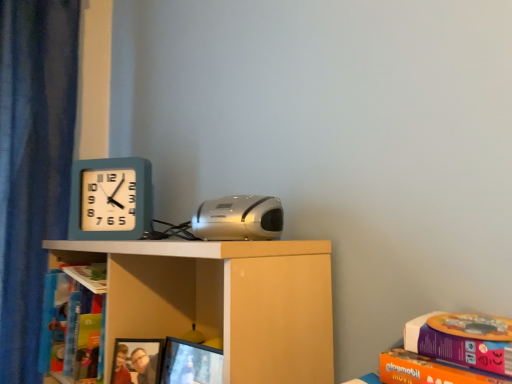
Question: Is blue cardboard book at left, arranged as the second book when viewed from the right, at the left side of silver metallic stereo at center?

Choices:
 (A) yes
 (B) no

Answer: (A)

Question: Can you confirm if blue cardboard book at left, acting as the 2th book starting from the front, is bigger than silver metallic stereo at center?

Choices:
 (A) yes
 (B) no

Answer: (B)

Question: Is silver metallic stereo at center inside blue cardboard book at left, acting as the 2th book starting from the front?

Choices:
 (A) yes
 (B) no

Answer: (B)

Question: From a real-world perspective, is blue cardboard book at left, the second book positioned from the top, on silver metallic stereo at center?

Choices:
 (A) no
 (B) yes

Answer: (A)

Question: Considering the relative sizes of blue cardboard book at left, acting as the 1th book starting from the bottom, and silver metallic stereo at center in the image provided, is blue cardboard book at left, acting as the 1th book starting from the bottom, taller than silver metallic stereo at center?

Choices:
 (A) no
 (B) yes

Answer: (B)

Question: Is blue cardboard book at left, acting as the 1th book starting from the bottom, located outside silver metallic stereo at center?

Choices:
 (A) no
 (B) yes

Answer: (B)

Question: Is hardcover book at left, the second book in the left-to-right sequence, surrounding matte black monitor at lower center?

Choices:
 (A) no
 (B) yes

Answer: (A)

Question: From a real-world perspective, is hardcover book at left, which ranks as the 1th book in top-to-bottom order, on matte black monitor at lower center?

Choices:
 (A) yes
 (B) no

Answer: (A)

Question: Is hardcover book at left, which ranks as the 1th book in top-to-bottom order, completely or partially outside of matte black monitor at lower center?

Choices:
 (A) no
 (B) yes

Answer: (B)

Question: Does hardcover book at left, which is the second book from bottom to top, have a lesser height compared to matte black monitor at lower center?

Choices:
 (A) yes
 (B) no

Answer: (A)

Question: Is hardcover book at left, which appears as the 1th book when viewed from the right, bigger than matte black monitor at lower center?

Choices:
 (A) yes
 (B) no

Answer: (B)

Question: From the image's perspective, does hardcover book at left, the first book from the front, appear lower than matte black monitor at lower center?

Choices:
 (A) yes
 (B) no

Answer: (B)

Question: Does silver metallic stereo at center have a lesser height compared to white matte shelf at center?

Choices:
 (A) yes
 (B) no

Answer: (A)